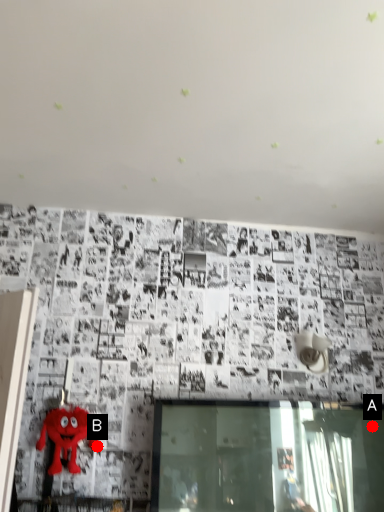
Question: Two points are circled on the image, labeled by A and B beside each circle. Which point is farther to the camera?

Choices:
 (A) A is further
 (B) B is further

Answer: (A)